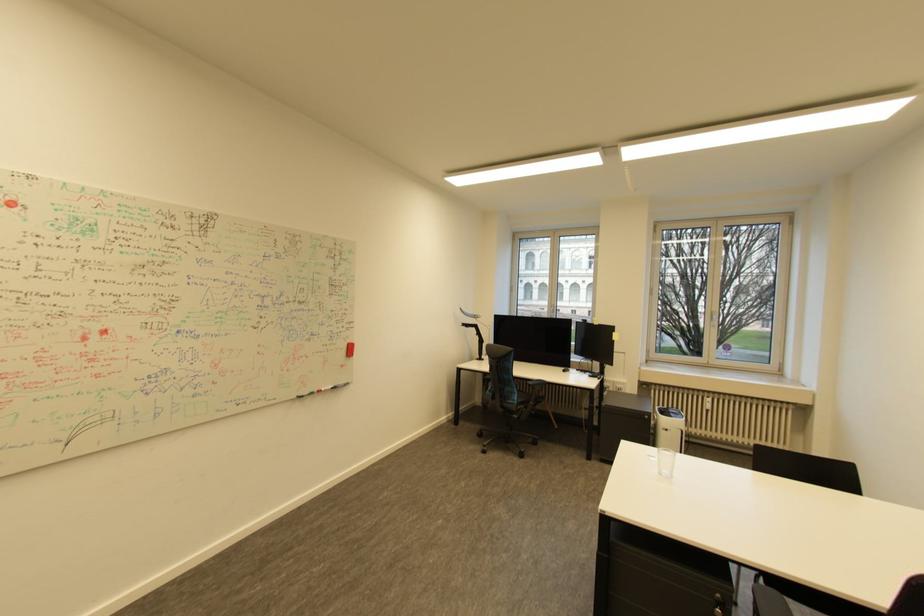
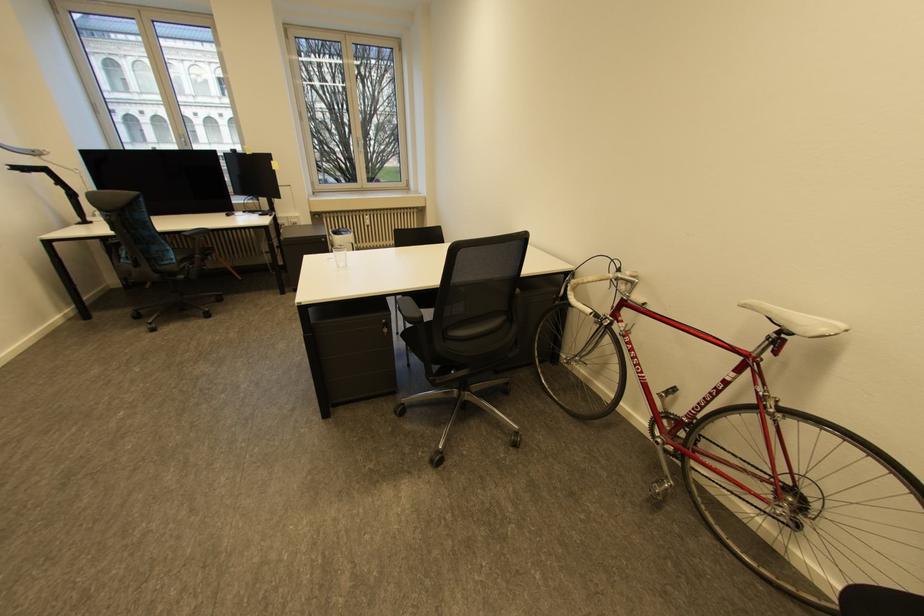
Find the pixel in the second image that matches (714,411) in the first image.

(374, 227)